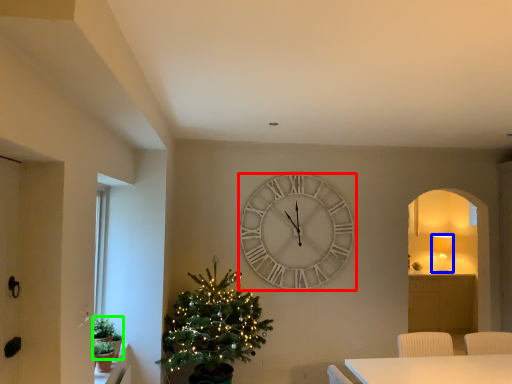
Question: Considering the real-world distances, which object is farthest from wall clock (highlighted by a red box)? lamp (highlighted by a blue box) or plant (highlighted by a green box)?

Choices:
 (A) lamp
 (B) plant

Answer: (A)